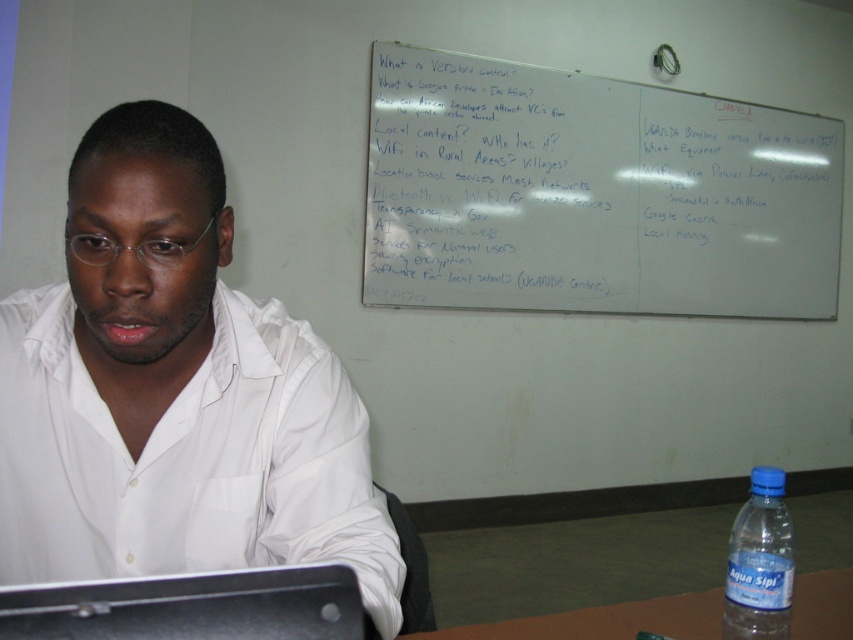
You are standing in the room and see two points marked on the whiteboard. The first point is at coordinates point (502, 74) and the second is at point (651, 621). Which point is closer to you when facing the whiteboard?

Point (502, 74) is behind point (651, 621), so the point closer to you when facing the whiteboard would be point (651, 621).

You are a photographer taking a picture of the scene. You need to focus on the white matte shirt at center and the blue plastic bottle at lower right. Which object should you adjust the focus for first if you want to capture both clearly in the same frame?

The white matte shirt at center is closer to the viewer than the blue plastic bottle at lower right. To capture both clearly, focus on the white matte shirt at center first, as objects closer to the camera require adjusting focus before those further away.